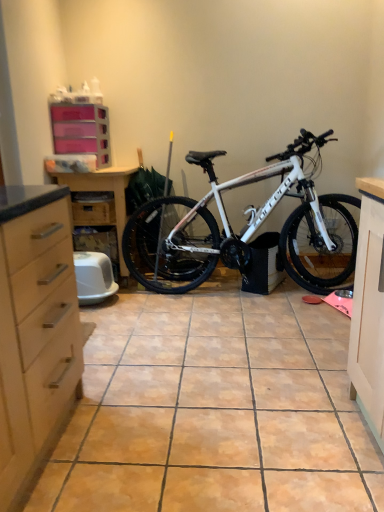
This screenshot has width=384, height=512. What do you see at coordinates (81, 130) in the screenshot?
I see `pink plastic drawers at upper left` at bounding box center [81, 130].

You are a GUI agent. You are given a task and a screenshot of the screen. Output one action in this format:
    pyautogui.click(x=<x>, y=<y>)
    Task: Click on the pink plastic drawers at upper left
    The height and width of the screenshot is (512, 384).
    Given the screenshot: What is the action you would take?
    pyautogui.click(x=81, y=130)

How many degrees apart are the facing directions of pink plastic drawers at upper left and matte wood dresser at left?

The angle between the facing direction of pink plastic drawers at upper left and the facing direction of matte wood dresser at left is 1.09 degrees.

Based on their positions, is pink plastic drawers at upper left located to the left or right of matte wood dresser at left?

Based on their positions, pink plastic drawers at upper left is located to the left of matte wood dresser at left.

Considering the positions of point (55, 145) and point (101, 174), is point (55, 145) closer or farther from the camera than point (101, 174)?

Point (55, 145) appears to be closer to the viewer than point (101, 174).

Which of these two, white matte bicycle at center or pink plastic drawers at upper left, is bigger?

white matte bicycle at center.

Which object is wider, white matte bicycle at center or pink plastic drawers at upper left?

white matte bicycle at center.

Considering the points (277, 243) and (100, 128), which point is in front, point (277, 243) or point (100, 128)?

Positioned in front is point (277, 243).

From their relative heights in the image, would you say white matte bicycle at center is taller or shorter than pink plastic drawers at upper left?

Clearly, white matte bicycle at center is taller compared to pink plastic drawers at upper left.

Does pink plastic drawers at upper left have a smaller size compared to wooden drawer at center-left?

Actually, pink plastic drawers at upper left might be larger than wooden drawer at center-left.

In the scene shown: Between pink plastic drawers at upper left and wooden drawer at center-left, which one has smaller width?

pink plastic drawers at upper left.

Based on the photo, which is less distant, (78, 108) or (91, 207)?

The point (78, 108) is closer to the camera.

Can you confirm if pink plastic drawers at upper left is positioned to the left of wooden drawer at center-left?

Yes, pink plastic drawers at upper left is to the left of wooden drawer at center-left.

How many degrees apart are the facing directions of matte wood dresser at left and wooden drawer at center-left?

There is a 0.000479-degree angle between the facing directions of matte wood dresser at left and wooden drawer at center-left.

Does matte wood dresser at left have a larger size compared to wooden drawer at center-left?

Yes.

Is matte wood dresser at left located outside wooden drawer at center-left?

Yes, matte wood dresser at left is outside of wooden drawer at center-left.

Which of these two, matte wood dresser at left or wooden drawer at center-left, is wider?

Wider between the two is matte wood dresser at left.

From the image's perspective, which object appears higher, pink plastic drawers at upper left or white matte bicycle at center?

pink plastic drawers at upper left is shown above in the image.

Is pink plastic drawers at upper left facing away from white matte bicycle at center?

No, pink plastic drawers at upper left is not facing the opposite direction of white matte bicycle at center.

Looking at their sizes, would you say pink plastic drawers at upper left is wider or thinner than white matte bicycle at center?

Clearly, pink plastic drawers at upper left has less width compared to white matte bicycle at center.

Does pink plastic drawers at upper left appear on the right side of white matte bicycle at center?

No, pink plastic drawers at upper left is not to the right of white matte bicycle at center.

Is white matte bicycle at center bigger or smaller than wooden drawer at center-left?

white matte bicycle at center is bigger than wooden drawer at center-left.

From the image's perspective, which is above, white matte bicycle at center or wooden drawer at center-left?

wooden drawer at center-left, from the image's perspective.

Is white matte bicycle at center positioned with its back to wooden drawer at center-left?

No, wooden drawer at center-left is not at the back of white matte bicycle at center.

In the scene shown: Is wooden drawer at center-left located within white matte bicycle at center?

Actually, wooden drawer at center-left is outside white matte bicycle at center.

Would you say white matte bicycle at center is to the left or to the right of matte wood dresser at left in the picture?

Based on their positions, white matte bicycle at center is located to the right of matte wood dresser at left.

From the image's perspective, is white matte bicycle at center located above or below matte wood dresser at left?

From the image's perspective, white matte bicycle at center appears above matte wood dresser at left.

Which object is more forward, white matte bicycle at center or matte wood dresser at left?

white matte bicycle at center is closer to the camera.

How many degrees apart are the facing directions of white matte bicycle at center and matte wood dresser at left?

white matte bicycle at center and matte wood dresser at left are facing 0.577 degrees away from each other.

Locate an element on the screen. This screenshot has width=384, height=512. cabinetry positioned vertically above the matte wood dresser at left (from a real-world perspective) is located at coordinates (81, 130).

Where is `cabinetry that is behind the white matte bicycle at center`? cabinetry that is behind the white matte bicycle at center is located at coordinates (81, 130).

Considering their positions, is white matte bicycle at center positioned further to pink plastic drawers at upper left than wooden drawer at center-left?

white matte bicycle at center is further to pink plastic drawers at upper left.

Estimate the real-world distances between objects in this image. Which object is further from white matte bicycle at center, pink plastic drawers at upper left or matte wood dresser at left?

pink plastic drawers at upper left.

Looking at the image, which one is located closer to wooden drawer at center-left, pink plastic drawers at upper left or matte wood dresser at left?

matte wood dresser at left is closer to wooden drawer at center-left.

Based on their spatial positions, is matte wood dresser at left or pink plastic drawers at upper left further from wooden drawer at center-left?

pink plastic drawers at upper left.

Based on their spatial positions, is white matte bicycle at center or pink plastic drawers at upper left further from matte wood dresser at left?

white matte bicycle at center.

When comparing their distances from pink plastic drawers at upper left, does white matte bicycle at center or matte wood dresser at left seem further?

white matte bicycle at center is further to pink plastic drawers at upper left.

Estimate the real-world distances between objects in this image. Which object is closer to white matte bicycle at center, wooden drawer at center-left or pink plastic drawers at upper left?

Among the two, wooden drawer at center-left is located nearer to white matte bicycle at center.

When comparing their distances from pink plastic drawers at upper left, does matte wood dresser at left or white matte bicycle at center seem closer?

matte wood dresser at left is closer to pink plastic drawers at upper left.

The width and height of the screenshot is (384, 512). In order to click on dresser located between pink plastic drawers at upper left and white matte bicycle at center in the left-right direction in this screenshot , I will do `click(102, 190)`.

Locate an element on the screen. This screenshot has height=512, width=384. drawer situated between pink plastic drawers at upper left and white matte bicycle at center from left to right is located at coordinates (94, 211).

At what (x,y) coordinates should I click in order to perform the action: click on dresser between wooden drawer at center-left and white matte bicycle at center in the horizontal direction. Please return your answer as a coordinate pair (x, y). The image size is (384, 512). Looking at the image, I should click on (102, 190).

At what (x,y) coordinates should I click in order to perform the action: click on drawer between pink plastic drawers at upper left and matte wood dresser at left vertically. Please return your answer as a coordinate pair (x, y). Image resolution: width=384 pixels, height=512 pixels. Looking at the image, I should click on (94, 211).